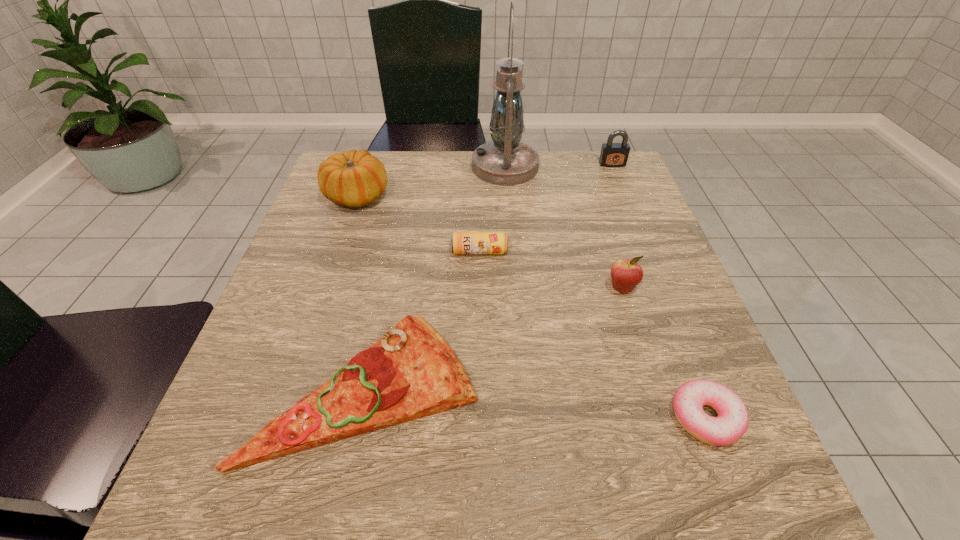
Choose which object is the fifth nearest neighbor to the doughnut. Please provide its 2D coordinates. Your answer should be formatted as a tuple, i.e. [(x, y)], where the tuple contains the x and y coordinates of a point satisfying the conditions above.

[(612, 154)]

This screenshot has height=540, width=960. I want to click on object that is the fourth closest one to the padlock, so click(354, 178).

This screenshot has height=540, width=960. In order to click on free region that satisfies the following two spatial constraints: 1. on the front side of the doughnut; 2. on the right side of the pizza in this screenshot , I will do `click(361, 417)`.

You are a GUI agent. You are given a task and a screenshot of the screen. Output one action in this format:
    pyautogui.click(x=<x>, y=<y>)
    Task: Click on the blank area in the image that satisfies the following two spatial constraints: 1. on the front side of the beer can; 2. on the left side of the gourd
    
    Given the screenshot: What is the action you would take?
    pyautogui.click(x=338, y=252)

Where is `vacant area in the image that satisfies the following two spatial constraints: 1. on the front side of the gourd; 2. on the left side of the apple`? This screenshot has width=960, height=540. vacant area in the image that satisfies the following two spatial constraints: 1. on the front side of the gourd; 2. on the left side of the apple is located at coordinates (325, 288).